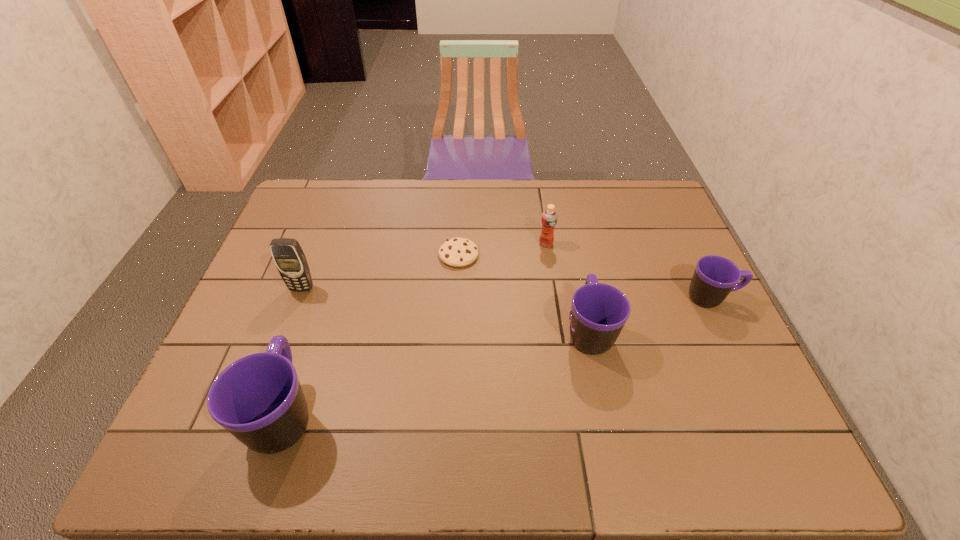
To make them evenly spaced by inserting another mug among them, please locate a vacant spot for this new mug. Please provide its 2D coordinates. Your answer should be formatted as a tuple, i.e. [(x, y)], where the tuple contains the x and y coordinates of a point satisfying the conditions above.

[(448, 369)]